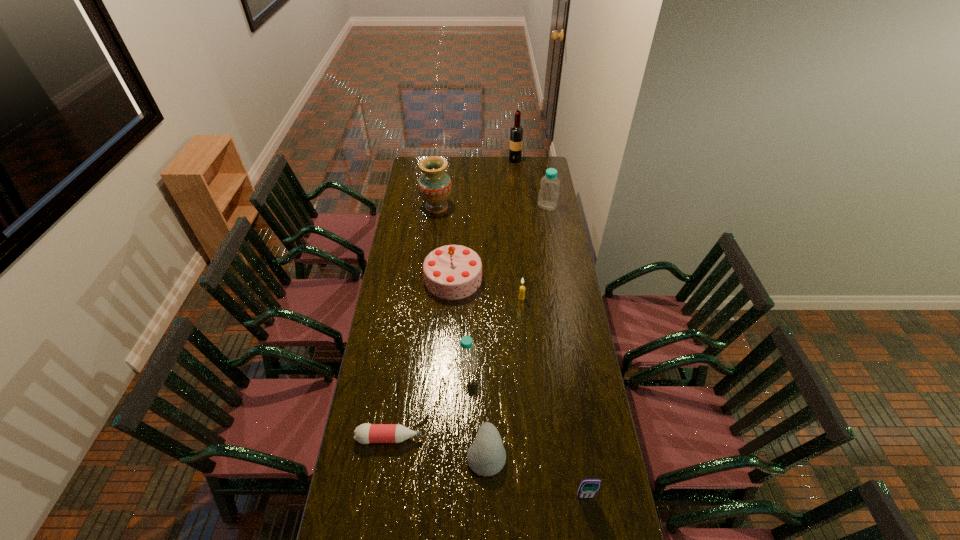
In order to click on the farthest object in this screenshot , I will do `click(516, 132)`.

Where is `the eighth shortest object`? the eighth shortest object is located at coordinates (434, 186).

At what (x,y) coordinates should I click in order to perform the action: click on the right blue bottle. Please return your answer as a coordinate pair (x, y). The image size is (960, 540). Looking at the image, I should click on (548, 195).

Find the location of a particular element. the tallest bottle is located at coordinates (548, 195).

This screenshot has height=540, width=960. In order to click on birthday cake in this screenshot , I will do `click(451, 272)`.

Image resolution: width=960 pixels, height=540 pixels. Identify the location of the smaller blue bottle. click(x=467, y=358).

Find the location of a particular element. This screenshot has width=960, height=540. the second farthest bottle is located at coordinates (467, 358).

At what (x,y) coordinates should I click in order to perform the action: click on candle. Please return your answer as a coordinate pair (x, y). The height and width of the screenshot is (540, 960). Looking at the image, I should click on (522, 288).

This screenshot has width=960, height=540. In order to click on cellular telephone in this screenshot , I will do `click(588, 488)`.

Find the location of `the eighth tallest object`. the eighth tallest object is located at coordinates (486, 456).